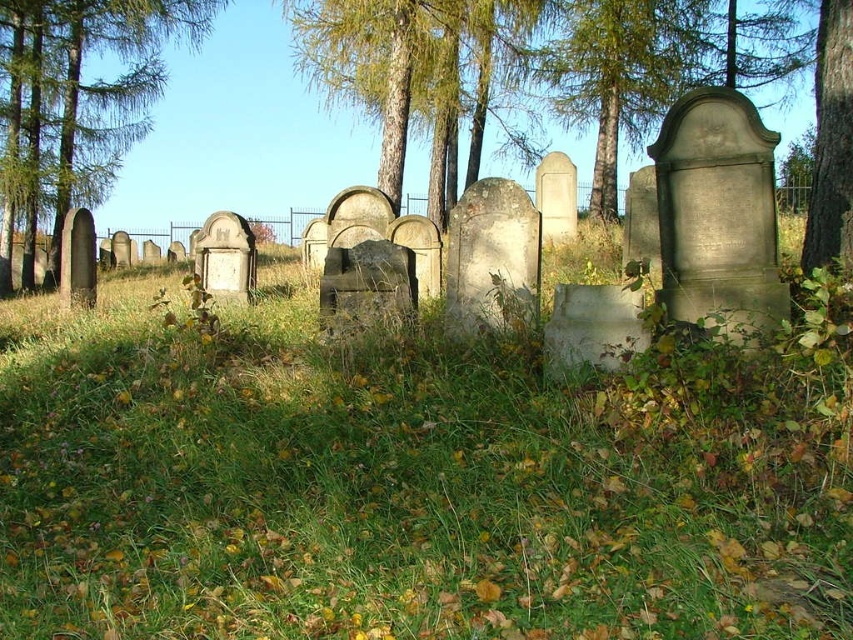
Can you confirm if green grassy at center is taller than green leafy tree at left?

No, green grassy at center is not taller than green leafy tree at left.

Between point (65, 536) and point (16, 56), which one is positioned in front?

Positioned in front is point (65, 536).

Where is `green grassy at center`? This screenshot has width=853, height=640. green grassy at center is located at coordinates (381, 493).

Is green grassy at center wider than green textured tree at center?

No.

Identify the location of green grassy at center. (381, 493).

The image size is (853, 640). What are the coordinates of `green grassy at center` in the screenshot? It's located at (381, 493).

Find the location of a particular element. This screenshot has width=853, height=640. green leafy tree at left is located at coordinates (74, 106).

Is green leafy tree at left smaller than green bark tree at center?

Yes.

Between point (193, 19) and point (412, 1), which one is positioned in front?

Point (412, 1) is in front.

Find the location of `green leafy tree at left`. green leafy tree at left is located at coordinates (74, 106).